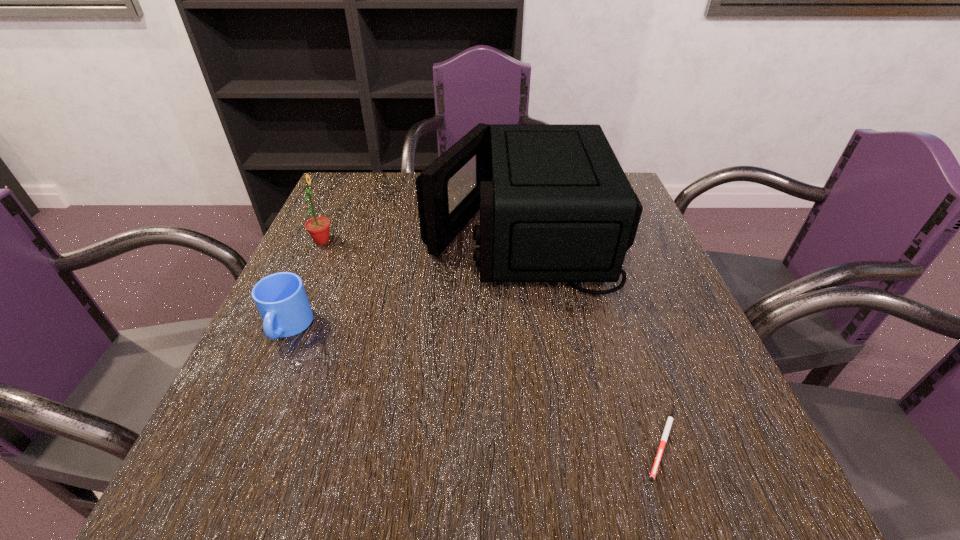
At what (x,y) coordinates should I click in order to perform the action: click on free area in between the third tallest object and the pen. Please return your answer as a coordinate pair (x, y). Looking at the image, I should click on pos(475,386).

Identify the location of free space between the microwave oven and the nearest object. (591, 339).

At what (x,y) coordinates should I click in order to perform the action: click on vacant space in between the second tallest object and the second nearest object. Please return your answer as a coordinate pair (x, y). This screenshot has height=540, width=960. Looking at the image, I should click on (305, 284).

Select which object is the second closest to the sunflower. Please provide its 2D coordinates. Your answer should be formatted as a tuple, i.e. [(x, y)], where the tuple contains the x and y coordinates of a point satisfying the conditions above.

[(555, 205)]

Find the location of `object that is the closest to the sunflower`. object that is the closest to the sunflower is located at coordinates (281, 299).

Identify the location of vacant position in the image that satisfies the following two spatial constraints: 1. with the door open on the tallest object; 2. on the side of the second nearest object with the handle. This screenshot has height=540, width=960. (533, 327).

The height and width of the screenshot is (540, 960). I want to click on free point that satisfies the following two spatial constraints: 1. with the door open on the tallest object; 2. on the side of the mug with the handle, so click(533, 327).

Where is `free location that satisfies the following two spatial constraints: 1. with the door open on the microwave oven; 2. on the side of the mug with the handle`? free location that satisfies the following two spatial constraints: 1. with the door open on the microwave oven; 2. on the side of the mug with the handle is located at coordinates [533, 327].